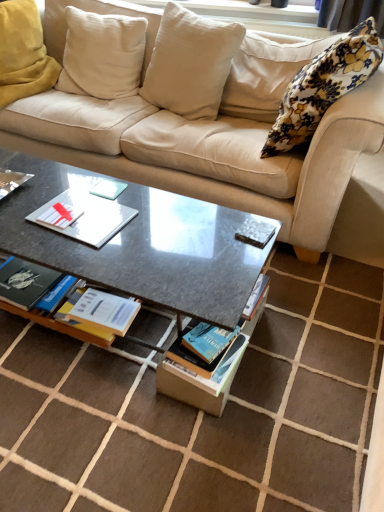
Find the location of `vacant region to the left of metallic silver magazine at center, the 2th magazine ordered from the bottom`. vacant region to the left of metallic silver magazine at center, the 2th magazine ordered from the bottom is located at coordinates (200, 233).